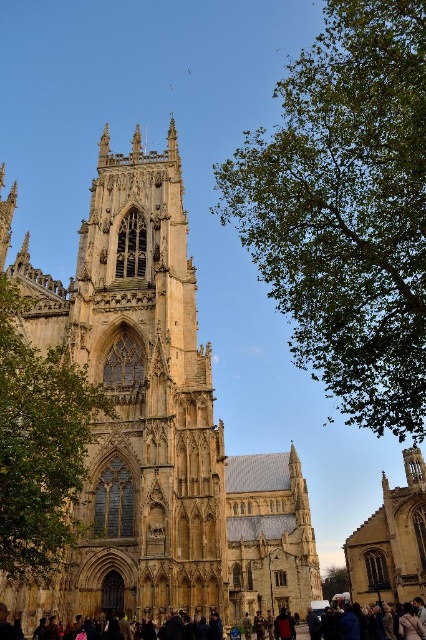
Does golden stone church at center come behind green leafy tree at upper right?

Yes, golden stone church at center is further from the viewer.

Does point (88, 512) lie in front of point (279, 179)?

No, it is behind (279, 179).

Identify the location of golden stone church at center. (160, 424).

What do you see at coordinates (409, 624) in the screenshot?
I see `dark brown leather jacket at lower center` at bounding box center [409, 624].

Is point (423, 632) farther from viewer compared to point (324, 593)?

No.

Identify the location of dark brown leather jacket at lower center. (409, 624).

Based on the photo, does golden stone church at center have a greater width compared to dark brown leather jacket at lower center?

Yes, golden stone church at center is wider than dark brown leather jacket at lower center.

Looking at this image, does golden stone church at center have a smaller size compared to dark brown leather jacket at lower center?

No.

Image resolution: width=426 pixels, height=640 pixels. What do you see at coordinates (160, 424) in the screenshot?
I see `golden stone church at center` at bounding box center [160, 424].

Locate an element on the screen. The width and height of the screenshot is (426, 640). golden stone church at center is located at coordinates (160, 424).